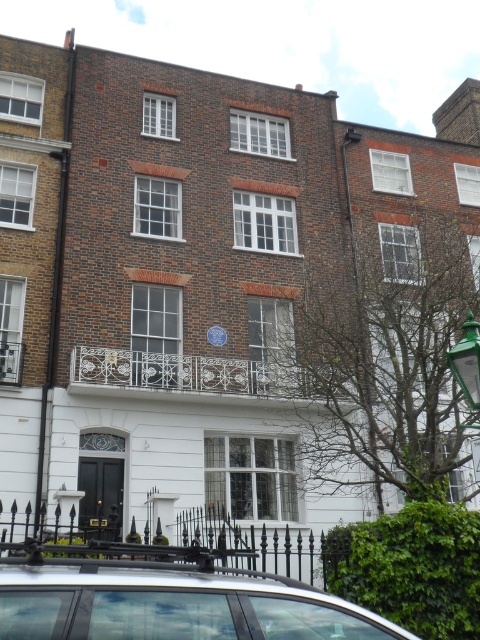
Does silver metallic car at lower left appear under green glass lamp post at right?

Yes, silver metallic car at lower left is below green glass lamp post at right.

Who is positioned more to the right, silver metallic car at lower left or green glass lamp post at right?

green glass lamp post at right is more to the right.

Which is in front, point (51, 560) or point (451, 365)?

Point (51, 560) is more forward.

Identify the location of silver metallic car at lower left. The height and width of the screenshot is (640, 480). (167, 600).